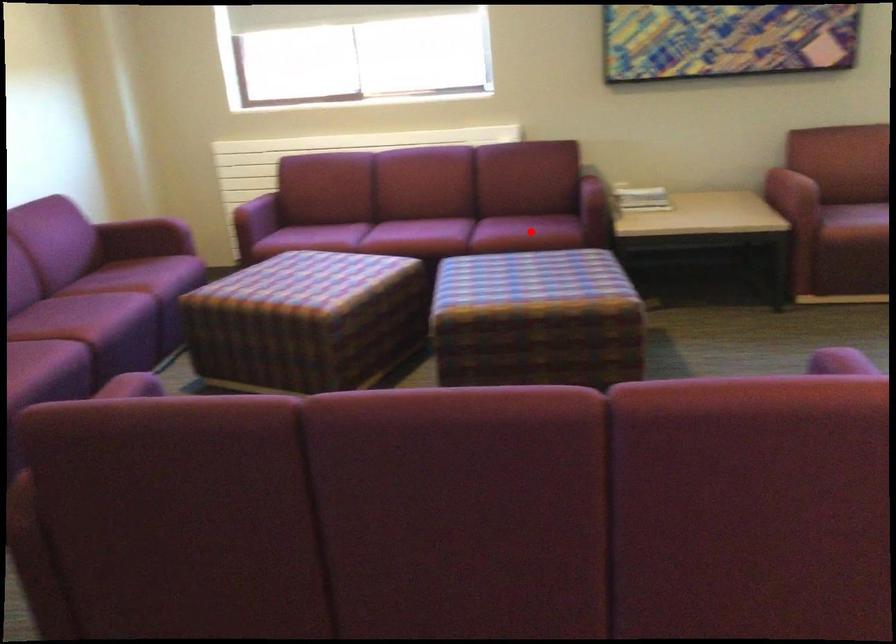
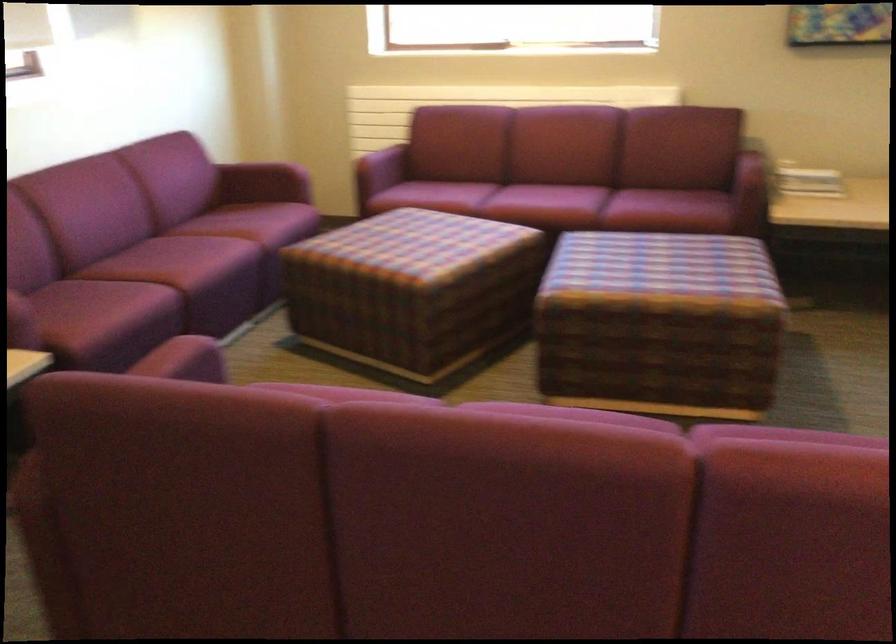
Question: I am providing you with two images of the same scene from different viewpoints. Given a red point in image1, look at the same physical point in image2. Is it:

Choices:
 (A) Closer to the viewpoint
 (B) Farther from the viewpoint

Answer: (A)